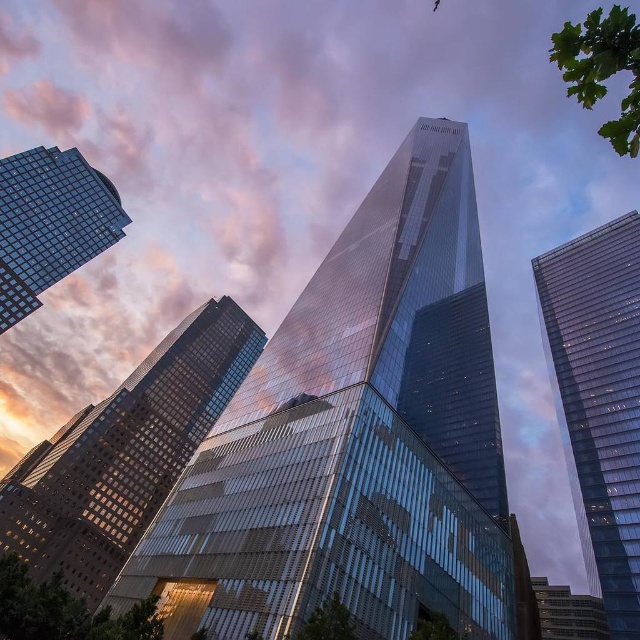
Question: Does transparent glass skyscraper at center appear on the right side of glassy reflective skyscraper at center?

Choices:
 (A) no
 (B) yes

Answer: (B)

Question: Which point is closer to the camera taking this photo?

Choices:
 (A) (218, 332)
 (B) (90, 227)
 (C) (580, 308)

Answer: (C)

Question: Estimate the real-world distances between objects in this image. Which object is closer to the glassy reflective skyscraper at lower right?

Choices:
 (A) glassy reflective skyscraper at center
 (B) transparent glass skyscraper at right
 (C) glassy reflective skyscraper at upper left
 (D) transparent glass skyscraper at center

Answer: (B)

Question: Is transparent glass skyscraper at center below transparent glass skyscraper at right?

Choices:
 (A) no
 (B) yes

Answer: (A)

Question: Does transparent glass skyscraper at right appear over glassy reflective skyscraper at lower right?

Choices:
 (A) no
 (B) yes

Answer: (B)

Question: Which point appears closest to the camera in this image?

Choices:
 (A) (593, 579)
 (B) (49, 444)

Answer: (A)